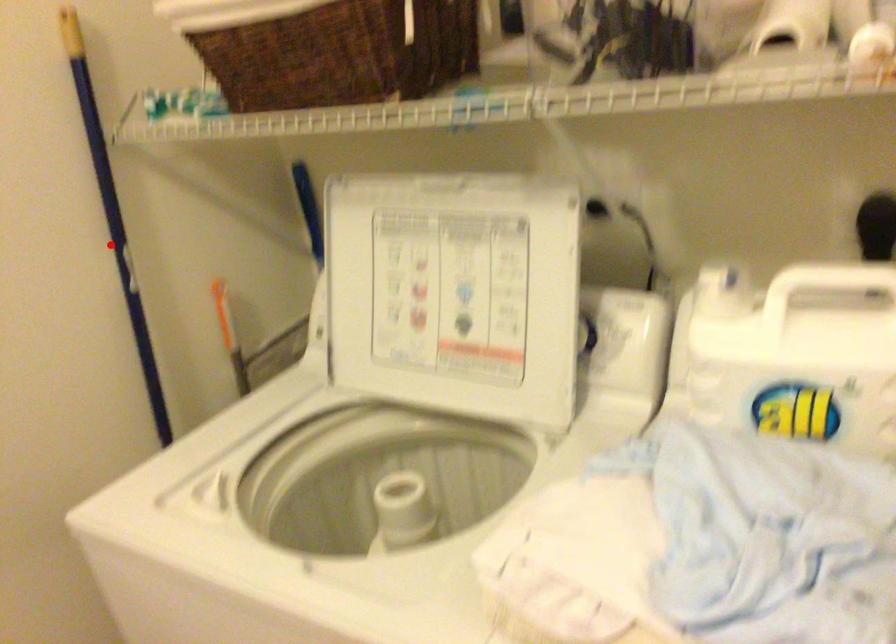
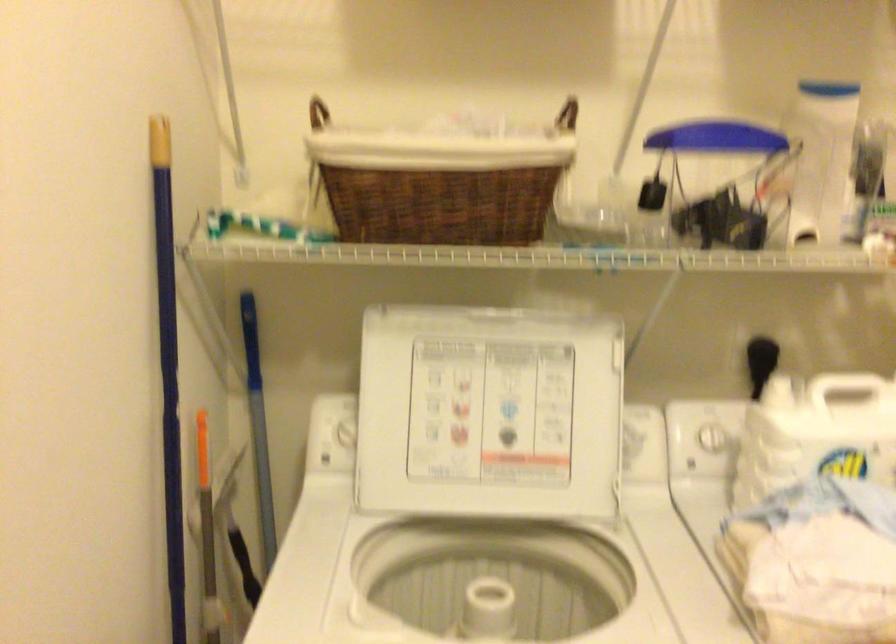
Question: A red point is marked in image1. In image2, is the corresponding 3D point closer to the camera or farther? Reply with the corresponding letter.

Choices:
 (A) The corresponding 3D point is closer.
 (B) The corresponding 3D point is farther.

Answer: (A)